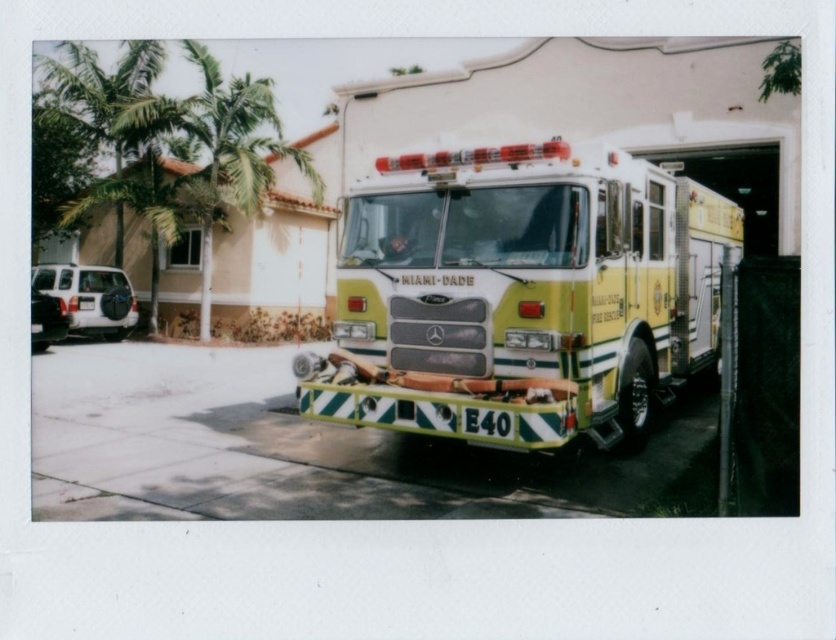
You are a pedestrian standing in front of the fire truck. You see the green leafy palm tree at upper left and the matte black suv at lower left. Which object is closer to you?

The green leafy palm tree at upper left is closer to you because it is further to the viewer than the matte black suv at lower left.

From the picture: You are a photographer planning to capture a wide shot of the fire truck. You need to ensure that both the green leafy palm tree at upper left and the matte black suv at lower left are fully visible in the frame. Based on their widths, which object might require you to adjust your camera angle to include it entirely?

The green leafy palm tree at upper left might be wider than the matte black suv at lower left, so you might need to adjust your camera angle to ensure the palm tree is fully visible in the frame.